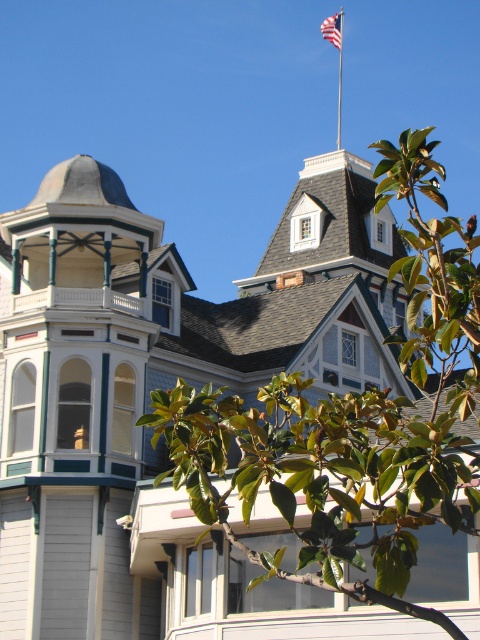
You are a window cleaner standing on the roof of the Victorian house. You need to clean both the green leafy tree at upper center and the american flag at upper center. Which object should you clean first if you want to start with the wider one?

The green leafy tree at upper center might be wider than the american flag at upper center, so you should clean the green leafy tree at upper center first.

From the picture: You are a window washer standing on the roof of the Victorian house. You need to clean both the green leafy tree at upper center and the metallic flag pole at upper center. Which object requires you to move further to the left to reach it?

The metallic flag pole at upper center requires moving further to the left because the green leafy tree at upper center is wider and may block access to it.

You are a drone operator trying to capture a photo of the Victorian house. Your drone is currently hovering at the green leafy tree at upper center and you need to fly it to the metallic flag pole at upper center. Given that the drone can only travel 300 feet before needing to recharge, will you be able to make the trip without recharging?

The green leafy tree at upper center and metallic flag pole at upper center are 354.72 feet apart from each other. Since the distance exceeds the drone travel limit of 300 feet, the drone will need to recharge before completing the trip.